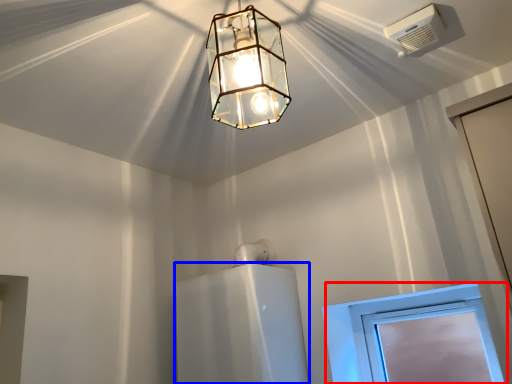
Question: Among these objects, which one is nearest to the camera, window (highlighted by a red box) or appliance (highlighted by a blue box)?

Choices:
 (A) window
 (B) appliance

Answer: (B)